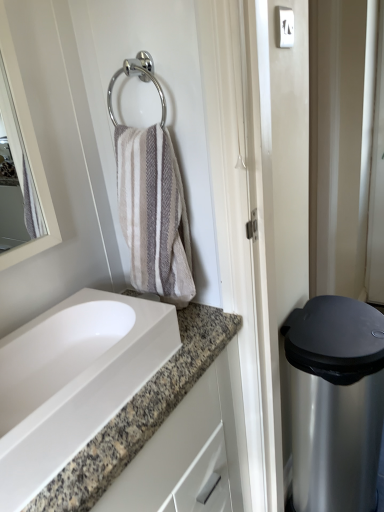
The image size is (384, 512). In order to click on satin silver trash can at right in this screenshot , I will do pos(335,402).

Describe the element at coordinates (335, 402) in the screenshot. I see `satin silver trash can at right` at that location.

Locate an element on the screen. This screenshot has height=512, width=384. chrome metallic towel ring at upper center is located at coordinates (139, 78).

Identify the location of white glossy sink at lower left. This screenshot has width=384, height=512. (73, 381).

What are the coordinates of `shower above the white glossy sink at lower left (from the image's perspective)` in the screenshot? It's located at (139, 78).

Is chrome metallic towel ring at upper center in front of or behind white glossy sink at lower left in the image?

In the image, chrome metallic towel ring at upper center appears behind white glossy sink at lower left.

Between chrome metallic towel ring at upper center and white glossy sink at lower left, which one has larger width?

white glossy sink at lower left is wider.

From the image's perspective, is chrome metallic towel ring at upper center above or below white glossy sink at lower left?

Based on their image positions, chrome metallic towel ring at upper center is located above white glossy sink at lower left.

Which of these two, white glossy sink at lower left or chrome metallic towel ring at upper center, is wider?

With larger width is white glossy sink at lower left.

Which point is more forward, (89, 306) or (151, 63)?

Positioned in front is point (151, 63).

Considering their positions, is white glossy sink at lower left located in front of or behind chrome metallic towel ring at upper center?

Clearly, white glossy sink at lower left is in front of chrome metallic towel ring at upper center.

Measure the distance between satin silver trash can at right and white glossy sink at lower left.

A distance of 61.38 centimeters exists between satin silver trash can at right and white glossy sink at lower left.

Considering the sizes of objects satin silver trash can at right and white glossy sink at lower left in the image provided, who is taller, satin silver trash can at right or white glossy sink at lower left?

Standing taller between the two is satin silver trash can at right.

From a real-world perspective, is satin silver trash can at right positioned above or below white glossy sink at lower left?

From a real-world perspective, satin silver trash can at right is physically below white glossy sink at lower left.

From the image's perspective, which is above, satin silver trash can at right or white glossy sink at lower left?

white glossy sink at lower left is shown above in the image.

Is satin silver trash can at right not near chrome metallic towel ring at upper center?

satin silver trash can at right is near chrome metallic towel ring at upper center, not far away.

Does satin silver trash can at right have a greater height compared to chrome metallic towel ring at upper center?

Yes.

Find the location of a particular element. This screenshot has width=384, height=512. appliance below the chrome metallic towel ring at upper center (from the image's perspective) is located at coordinates (335, 402).

Between satin silver trash can at right and chrome metallic towel ring at upper center, which one is positioned in front?

chrome metallic towel ring at upper center is more forward.

From the image's perspective, which object appears higher, white glossy sink at lower left or satin silver trash can at right?

white glossy sink at lower left.

Is point (39, 430) positioned in front of point (366, 313)?

Yes, point (39, 430) is closer to viewer.

Can you confirm if white glossy sink at lower left is wider than satin silver trash can at right?

In fact, white glossy sink at lower left might be narrower than satin silver trash can at right.

Between white glossy sink at lower left and satin silver trash can at right, which one has larger size?

satin silver trash can at right.

Is chrome metallic towel ring at upper center touching satin silver trash can at right?

No, chrome metallic towel ring at upper center is not next to satin silver trash can at right.

From the picture: Is satin silver trash can at right completely or partially inside chrome metallic towel ring at upper center?

Definitely not — satin silver trash can at right is not inside chrome metallic towel ring at upper center.

Does chrome metallic towel ring at upper center turn towards satin silver trash can at right?

No.

How far apart are chrome metallic towel ring at upper center and satin silver trash can at right?

35.51 inches.

The width and height of the screenshot is (384, 512). In the image, there is a chrome metallic towel ring at upper center. Find the location of `sink below it (from the image's perspective)`. sink below it (from the image's perspective) is located at coordinates (73, 381).

The image size is (384, 512). I want to click on sink in front of the chrome metallic towel ring at upper center, so click(73, 381).

Based on their spatial positions, is satin silver trash can at right or chrome metallic towel ring at upper center closer to white glossy sink at lower left?

chrome metallic towel ring at upper center lies closer to white glossy sink at lower left than the other object.

From the image, which object appears to be nearer to satin silver trash can at right, white glossy sink at lower left or chrome metallic towel ring at upper center?

Among the two, white glossy sink at lower left is located nearer to satin silver trash can at right.

Considering their positions, is satin silver trash can at right positioned closer to chrome metallic towel ring at upper center than white glossy sink at lower left?

white glossy sink at lower left is closer to chrome metallic towel ring at upper center.

Considering their positions, is chrome metallic towel ring at upper center positioned closer to satin silver trash can at right than white glossy sink at lower left?

white glossy sink at lower left is closer to satin silver trash can at right.

From the picture: Which object lies nearer to the anchor point white glossy sink at lower left, chrome metallic towel ring at upper center or satin silver trash can at right?

Among the two, chrome metallic towel ring at upper center is located nearer to white glossy sink at lower left.

Which object lies nearer to the anchor point chrome metallic towel ring at upper center, white glossy sink at lower left or satin silver trash can at right?

white glossy sink at lower left is closer to chrome metallic towel ring at upper center.

Locate an element on the screen. sink between chrome metallic towel ring at upper center and satin silver trash can at right in the up-down direction is located at coordinates (73, 381).